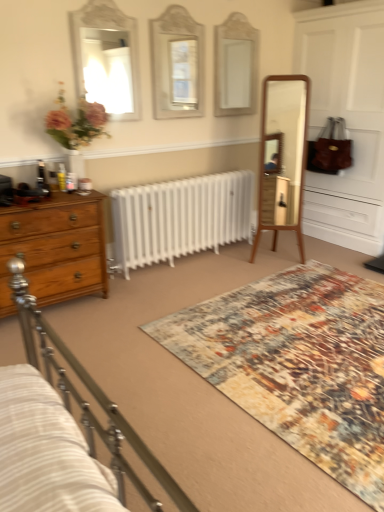
Find the location of a particular element. spots to the right of wooden chest of drawers at left is located at coordinates (129, 303).